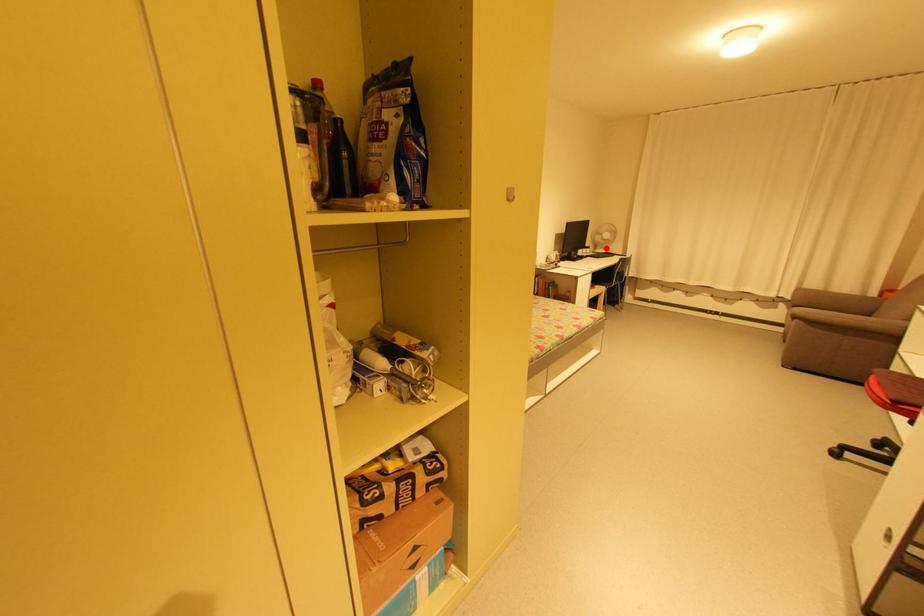
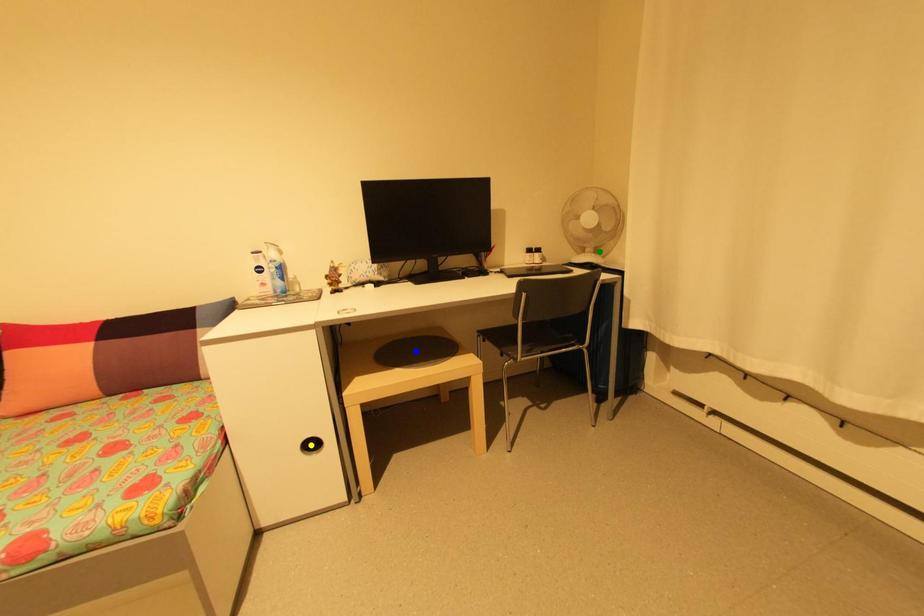
Question: I am providing you with two images of the same scene from different viewpoints. A red point is marked on the first image. You are given multiple points on the second image. Which spot in image 2 lines up with the point in image 1?

Choices:
 (A) green point
 (B) yellow point
 (C) blue point

Answer: (A)